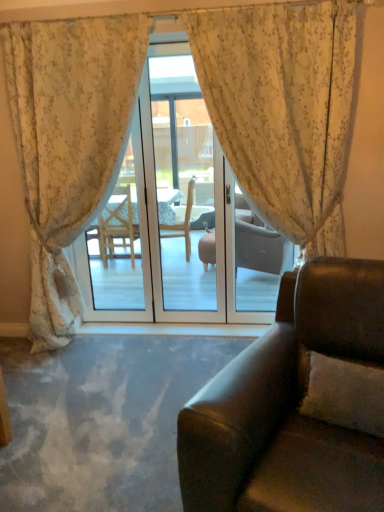
Question: From a real-world perspective, does floral fabric curtain at center, which is the second curtain in right-to-left order, sit lower than floral sheer curtain at center, which is the 1th curtain in right-to-left order?

Choices:
 (A) yes
 (B) no

Answer: (B)

Question: Is floral sheer curtain at center, which is the 1th curtain in right-to-left order, a part of floral fabric curtain at center, which is the second curtain in right-to-left order?

Choices:
 (A) yes
 (B) no

Answer: (B)

Question: From the image's perspective, is floral fabric curtain at center, which is the second curtain in right-to-left order, on floral sheer curtain at center, which is the 1th curtain in right-to-left order?

Choices:
 (A) no
 (B) yes

Answer: (A)

Question: From the image's perspective, is floral fabric curtain at center, placed as the first curtain when sorted from left to right, under floral sheer curtain at center, the second curtain from the left?

Choices:
 (A) yes
 (B) no

Answer: (A)

Question: Is floral fabric curtain at center, placed as the first curtain when sorted from left to right, directly adjacent to floral sheer curtain at center, the second curtain from the left?

Choices:
 (A) no
 (B) yes

Answer: (A)

Question: Is floral fabric curtain at center, which is the second curtain in right-to-left order, positioned with its back to floral sheer curtain at center, which is the 1th curtain in right-to-left order?

Choices:
 (A) no
 (B) yes

Answer: (A)

Question: Does transparent glass door at center come behind floral sheer curtain at center, the second curtain from the left?

Choices:
 (A) yes
 (B) no

Answer: (A)

Question: Does transparent glass door at center appear on the right side of floral sheer curtain at center, which is the 1th curtain in right-to-left order?

Choices:
 (A) yes
 (B) no

Answer: (B)

Question: Is transparent glass door at center directly adjacent to floral sheer curtain at center, which is the 1th curtain in right-to-left order?

Choices:
 (A) no
 (B) yes

Answer: (A)

Question: Is transparent glass door at center not inside floral sheer curtain at center, which is the 1th curtain in right-to-left order?

Choices:
 (A) no
 (B) yes

Answer: (B)

Question: Is there a large distance between transparent glass door at center and floral sheer curtain at center, the second curtain from the left?

Choices:
 (A) no
 (B) yes

Answer: (B)

Question: Is floral sheer curtain at center, the second curtain from the left, a part of transparent glass door at center?

Choices:
 (A) no
 (B) yes

Answer: (A)

Question: Is white textured pillow at lower right turned away from floral fabric curtain at center, which is the second curtain in right-to-left order?

Choices:
 (A) yes
 (B) no

Answer: (B)